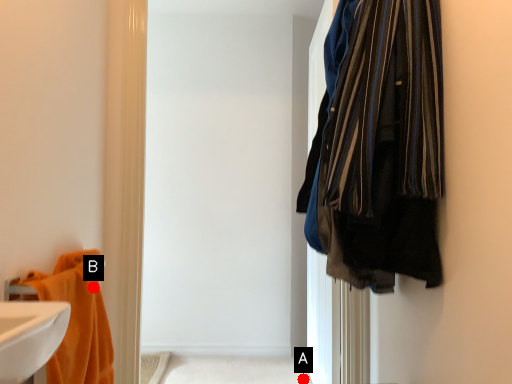
Question: Two points are circled on the image, labeled by A and B beside each circle. Which point is closer to the camera?

Choices:
 (A) A is closer
 (B) B is closer

Answer: (B)